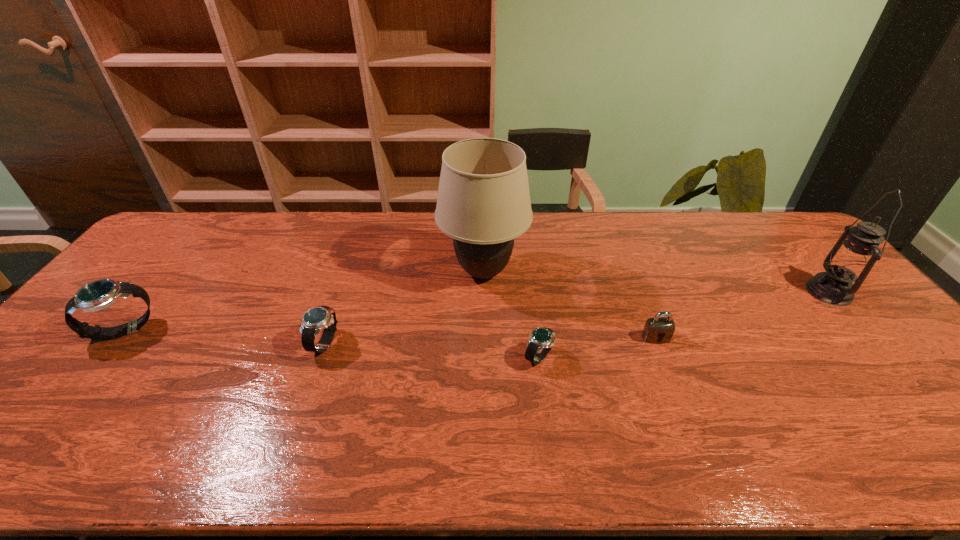
Please point a spot to add another watch on the right. Please provide its 2D coordinates. Your answer should be formatted as a tuple, i.e. [(x, y)], where the tuple contains the x and y coordinates of a point satisfying the conditions above.

[(765, 372)]